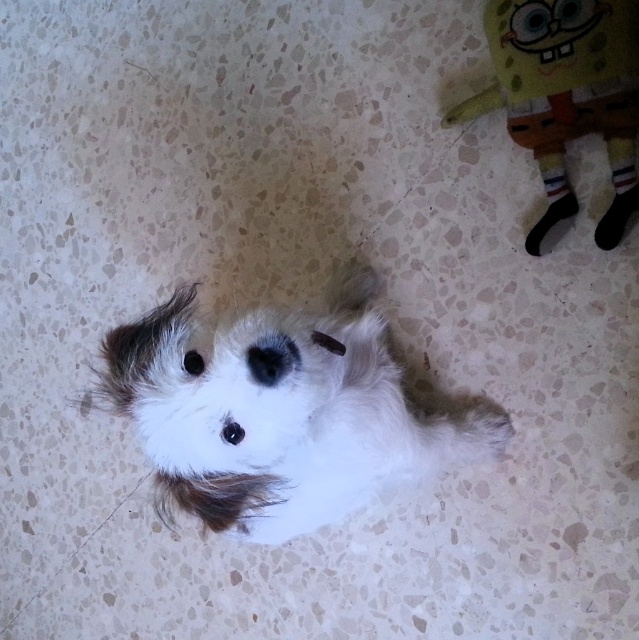
You are a dog owner who wants to place a new toy for your dog. The toy you have is the same size as the yellow plush toy at upper right. If you want to ensure the toy is visible to the dog, where should you place it in relation to the fluffy white dog at center?

Since the fluffy white dog at center is taller than the yellow plush toy at upper right, placing the new toy at a higher position relative to the dog would make it more visible. Alternatively, positioning it closer to the dog might also ensure visibility, but height could be a factor due to the size difference.

You are a dog owner who wants to ensure your fluffy white dog at center can reach its yellow plush toy at upper right. Given that the dog can stretch its neck up to 18 inches, can it reach the toy?

The distance between the fluffy white dog at center and the yellow plush toy at upper right is 18.81 inches. Since the dog can only stretch its neck up to 18 inches, it cannot reach the toy.

You are holding a treat and want to toss it to the fluffy white dog at center. However, you notice the yellow plush toy at upper right might be in the way. Can you safely throw the treat to the dog without hitting the toy?

The fluffy white dog at center is positioned under the yellow plush toy at upper right, so tossing the treat directly to the dog might not hit the toy if aimed carefully between them. However, ensure the trajectory avoids the toy above.